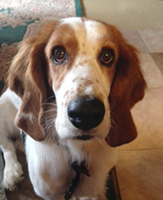
You are a GUI agent. You are given a task and a screenshot of the screen. Output one action in this format:
    pyautogui.click(x=<x>, y=<y>)
    Task: Click on the white fur
    This screenshot has height=200, width=163.
    Given the screenshot: What is the action you would take?
    pyautogui.click(x=50, y=162), pyautogui.click(x=15, y=100), pyautogui.click(x=5, y=144), pyautogui.click(x=101, y=158), pyautogui.click(x=95, y=189), pyautogui.click(x=62, y=124), pyautogui.click(x=106, y=82), pyautogui.click(x=66, y=84), pyautogui.click(x=70, y=19), pyautogui.click(x=93, y=29)